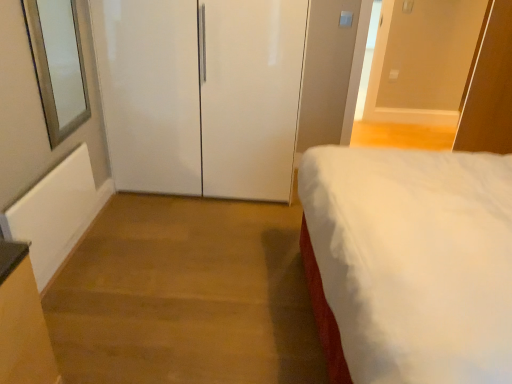
Question: In terms of width, does white soft bed at right look wider or thinner when compared to white glossy door at center, which is the second door in right-to-left order?

Choices:
 (A) wide
 (B) thin

Answer: (A)

Question: Considering the positions of point (489, 365) and point (208, 109), is point (489, 365) closer or farther from the camera than point (208, 109)?

Choices:
 (A) closer
 (B) farther

Answer: (A)

Question: Which of these objects is positioned closest to the white glossy door at center, which is the second door in right-to-left order?

Choices:
 (A) white glossy door at upper right, the first door when ordered from right to left
 (B) white soft bed at right
 (C) clear glass window at left

Answer: (C)

Question: Based on their relative distances, which object is nearer to the white glossy door at center, the 1th door positioned from the left?

Choices:
 (A) white glossy door at upper right, the first door when ordered from right to left
 (B) white soft bed at right
 (C) clear glass window at left

Answer: (C)